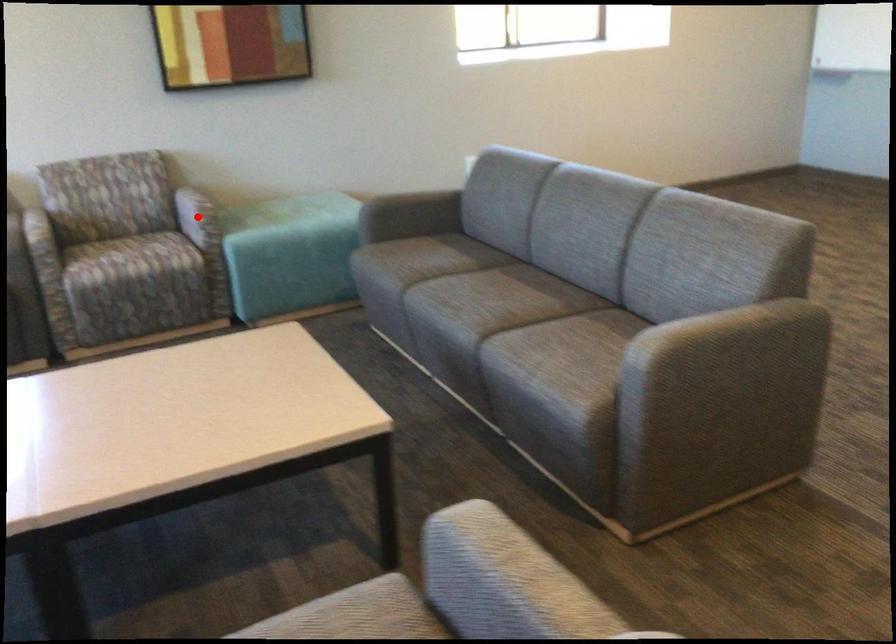
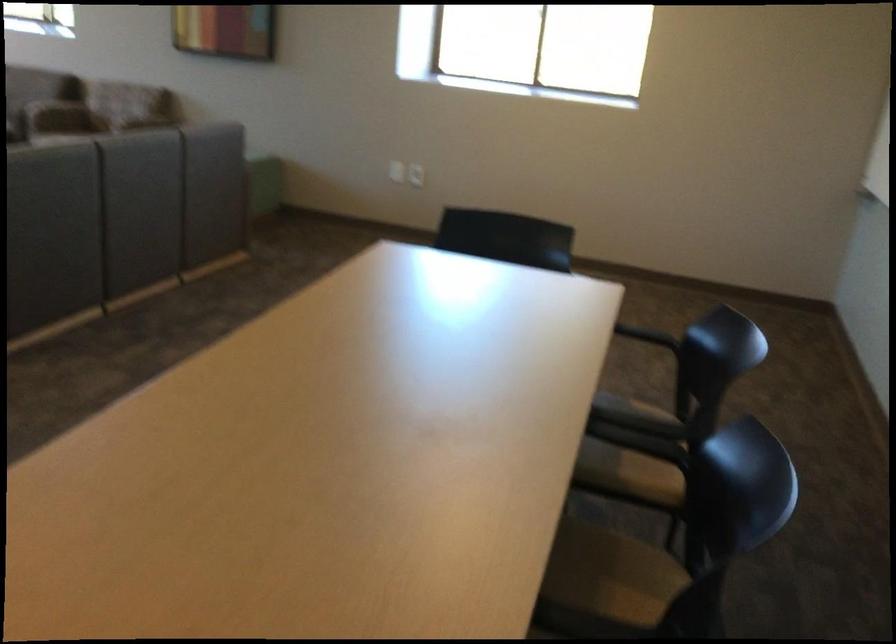
Question: I am providing you with two images of the same scene from different viewpoints. A red point is marked on the first image. Can you still see the location of the red point in image 2?

Choices:
 (A) Yes
 (B) No

Answer: (B)